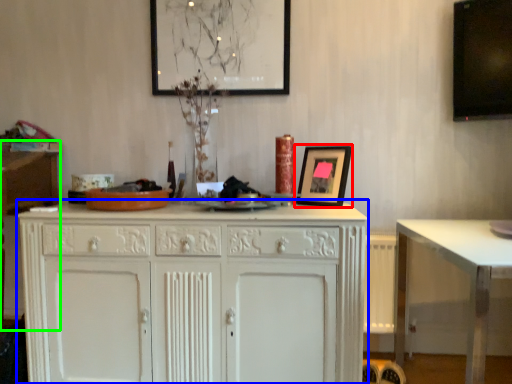
Question: Considering the real-world distances, which object is closest to picture frame (highlighted by a red box)? cabinetry (highlighted by a blue box) or vanity (highlighted by a green box).

Choices:
 (A) cabinetry
 (B) vanity

Answer: (A)